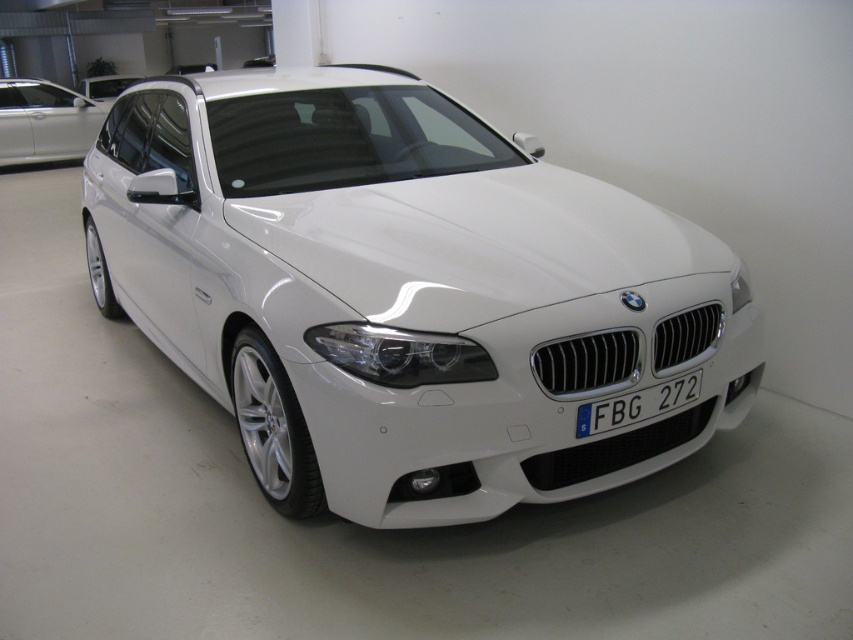
You are a parking attendant and need to guide a driver to park their car in the same position as the white glossy car at center. The driver asks if their car will fit between the blue metallic license plate at center and the wall. Can you confirm?

The white glossy car at center is to the left of the blue metallic license plate at center, so there is space between them. The driver can park their car in the same position as the white glossy car at center, ensuring it stays to the left of the blue metallic license plate at center and away from the wall.

You are standing in the showroom and want to move from the point at the back of the white BMW car to the front. Which point should you walk towards, point at coordinate (619, 419) or point at coordinate (119, 92)?

You should walk towards point at coordinate (119, 92) because point at coordinate (619, 419) is in front of point at coordinate (119, 92), meaning the latter is closer to the back of the car.

From the picture: You are standing in front of the white BMW car in the showroom. There are two points marked on the car, one at coordinate point (399, 422) and the other at point (657, 396). Which of these two points is closer to you?

Point (399, 422) is in front of point (657, 396), so the point closer to you is point (399, 422).